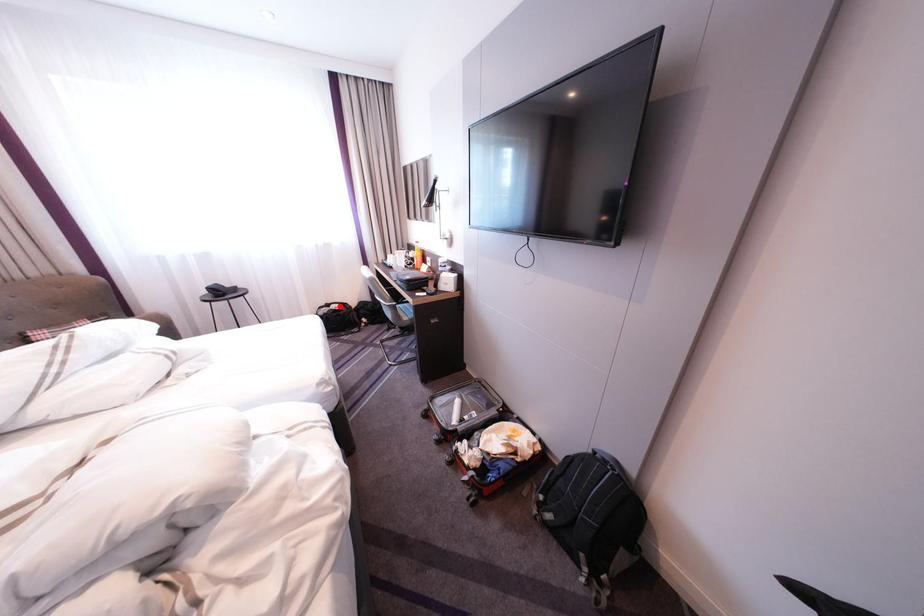
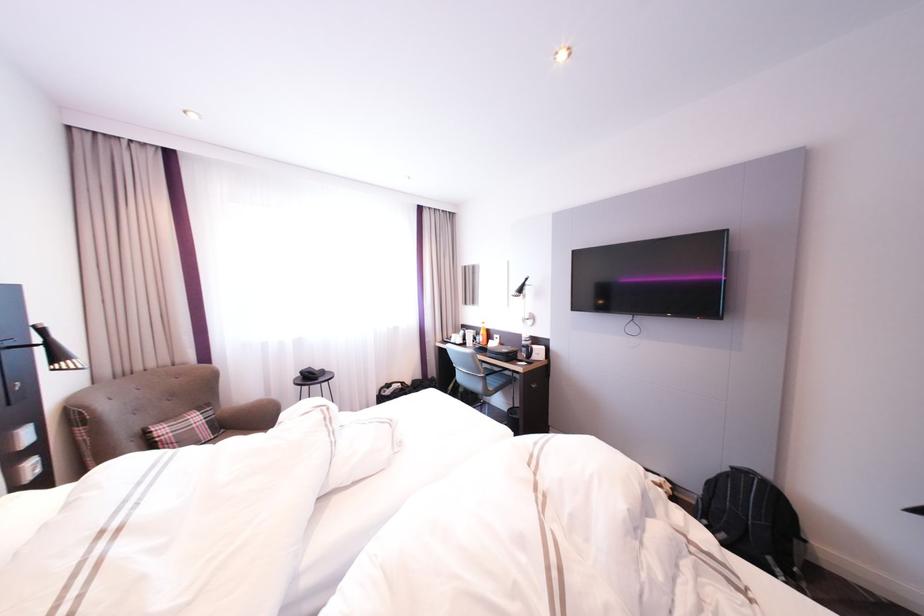
Locate, in the second image, the point that corresponds to the highlighted location in the first image.

(400, 386)